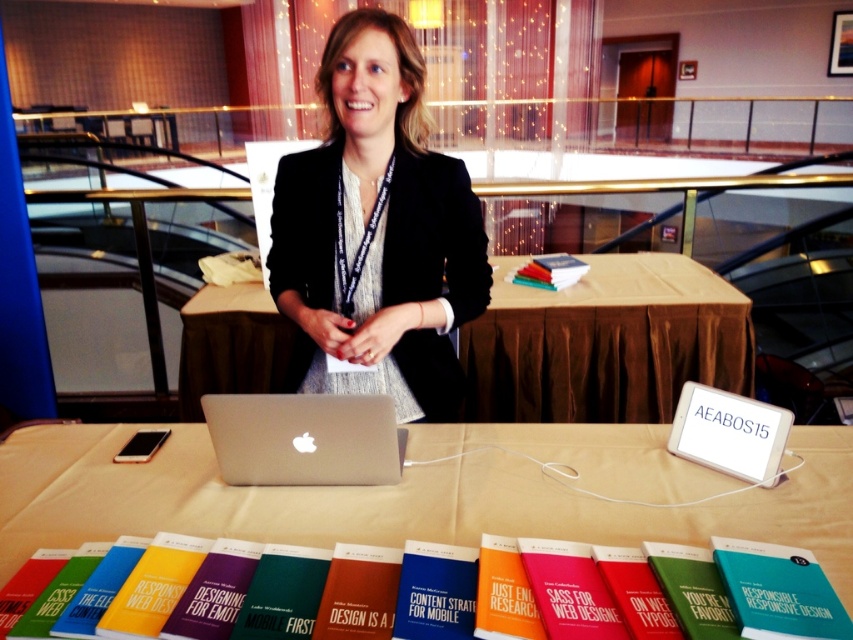
What is located at the coordinates point (425, 492) in the image?

The white matte table at center is located at point (425, 492).

You are a photographer standing at the camera position. You want to capture a photo of the white plastic tablet at center without any obstructions. Is the tablet within your reach to adjust its position if needed?

The white plastic tablet at center and camera are 4.07 feet apart. Since the distance is more than an average person can reach, you cannot adjust the tablet without moving closer.

You are attending a conference and need to locate the matte red book at center on the table. Based on the coordinates provided, where exactly should you look on the table?

The matte red book at center is located at point coordinates [358,593].